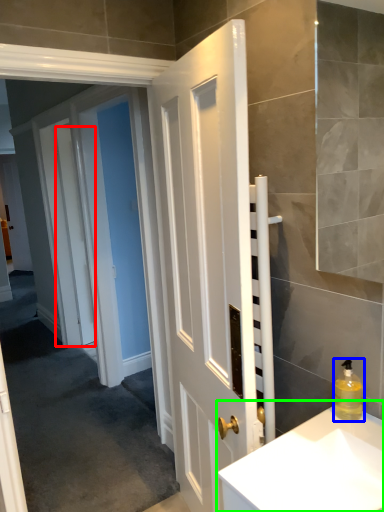
Question: Estimate the real-world distances between objects in this image. Which object is farther from door (highlighted by a red box), soap dispenser (highlighted by a blue box) or sink (highlighted by a green box)?

Choices:
 (A) soap dispenser
 (B) sink

Answer: (A)